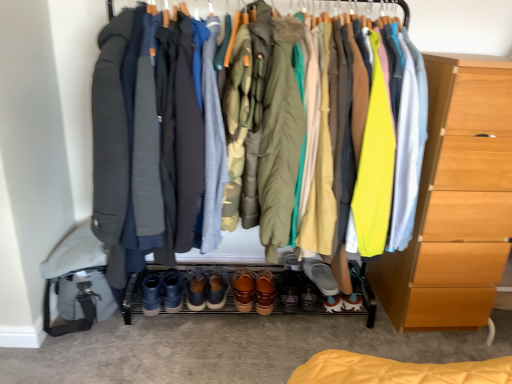
Question: Does brown suede shoes at center, the sixth footwear positioned from the right, appear on the left side of brown leather shoes at center, which is counted as the third footwear, starting from the left?

Choices:
 (A) yes
 (B) no

Answer: (A)

Question: From the image's perspective, would you say brown suede shoes at center, the first footwear from the left, is shown under brown leather shoes at center, which is counted as the third footwear, starting from the left?

Choices:
 (A) yes
 (B) no

Answer: (B)

Question: Could brown leather shoes at center, which is counted as the third footwear, starting from the left, be considered to be inside brown suede shoes at center, the first footwear from the left?

Choices:
 (A) yes
 (B) no

Answer: (B)

Question: Is brown suede shoes at center, the first footwear from the left, completely or partially outside of brown leather shoes at center, the fourth footwear in the right-to-left sequence?

Choices:
 (A) no
 (B) yes

Answer: (B)

Question: Considering the relative sizes of brown suede shoes at center, the sixth footwear positioned from the right, and brown leather shoes at center, the fourth footwear in the right-to-left sequence, in the image provided, is brown suede shoes at center, the sixth footwear positioned from the right, smaller than brown leather shoes at center, the fourth footwear in the right-to-left sequence,?

Choices:
 (A) yes
 (B) no

Answer: (B)

Question: Considering their positions, is gray suede shoe at center, the 6th footwear when ordered from left to right, located in front of or behind light wood chest of drawers at right?

Choices:
 (A) behind
 (B) front

Answer: (A)

Question: Is point (328, 276) positioned closer to the camera than point (437, 74)?

Choices:
 (A) closer
 (B) farther

Answer: (B)

Question: From a real-world perspective, is gray suede shoe at center, the 6th footwear when ordered from left to right, physically located above or below light wood chest of drawers at right?

Choices:
 (A) above
 (B) below

Answer: (B)

Question: In terms of size, does gray suede shoe at center, the 6th footwear when ordered from left to right, appear bigger or smaller than light wood chest of drawers at right?

Choices:
 (A) small
 (B) big

Answer: (A)

Question: Would you say camouflage fabric robe at center, which is counted as the 2th robe, starting from the right, is to the left or to the right of gray woolen robe at center, placed as the second robe when sorted from left to right, in the picture?

Choices:
 (A) left
 (B) right

Answer: (B)

Question: From a real-world perspective, is camouflage fabric robe at center, placed as the 3th robe when sorted from left to right, physically located above or below gray woolen robe at center, placed as the second robe when sorted from left to right?

Choices:
 (A) above
 (B) below

Answer: (A)

Question: Considering their positions, is camouflage fabric robe at center, which is counted as the 2th robe, starting from the right, located in front of or behind gray woolen robe at center, placed as the second robe when sorted from left to right?

Choices:
 (A) behind
 (B) front

Answer: (B)

Question: Do you think camouflage fabric robe at center, placed as the 3th robe when sorted from left to right, is within gray woolen robe at center, placed as the second robe when sorted from left to right, or outside of it?

Choices:
 (A) outside
 (B) inside

Answer: (A)

Question: From the image's perspective, is gray woolen robe at center, the 3th robe positioned from the right, positioned above or below matte olive green coat at center, marked as the fourth robe in a left-to-right arrangement?

Choices:
 (A) above
 (B) below

Answer: (A)

Question: From a real-world perspective, relative to matte olive green coat at center, the 1th robe when ordered from right to left, is gray woolen robe at center, the 3th robe positioned from the right, vertically above or below?

Choices:
 (A) below
 (B) above

Answer: (A)